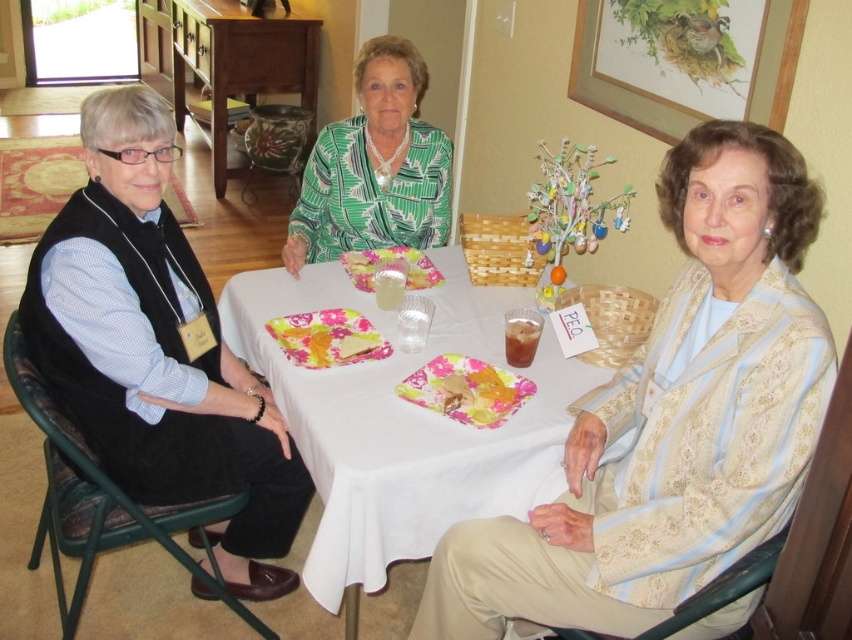
You are standing at the entrance of the room and want to pick up the light beige textured jacket at lower right. Which direction should you move to reach it?

The light beige textured jacket at lower right is located at point (671, 419), so you should move towards the lower right direction to reach it.